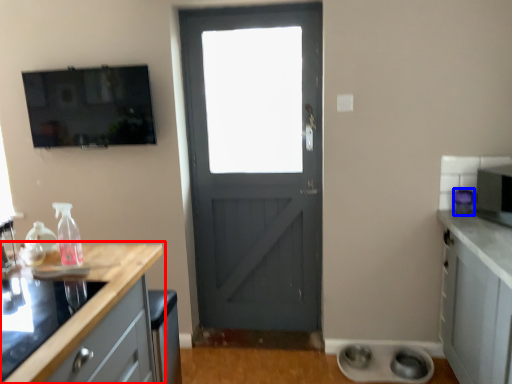
Question: Which point is closer to the camera, countertop (highlighted by a red box) or appliance (highlighted by a blue box)?

Choices:
 (A) countertop
 (B) appliance

Answer: (A)